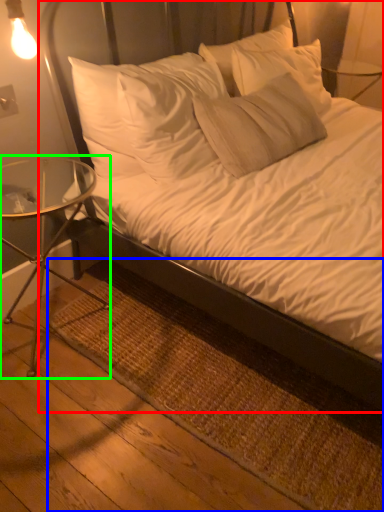
Question: Based on their relative distances, which object is farther from bed (highlighted by a red box)? Choose from mat (highlighted by a blue box) and table (highlighted by a green box).

Choices:
 (A) mat
 (B) table

Answer: (B)